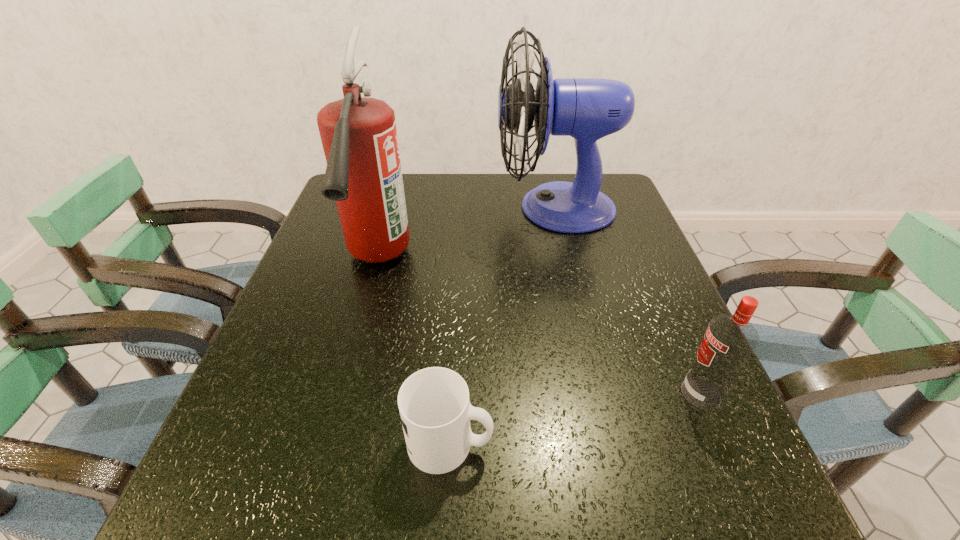
Locate an element on the screen. The height and width of the screenshot is (540, 960). vacant space located 0.240m on the front label of the second shortest object is located at coordinates (543, 393).

Identify the location of free space located on the front label of the second shortest object. The width and height of the screenshot is (960, 540). tap(549, 393).

This screenshot has width=960, height=540. Find the location of `vacant region located on the front label of the second shortest object`. vacant region located on the front label of the second shortest object is located at coordinates (468, 393).

What are the coordinates of `vacant space located on the handle side of the shortest object` in the screenshot? It's located at 593,443.

The image size is (960, 540). I want to click on object at the far edge, so click(x=587, y=109).

Locate an element on the screen. The width and height of the screenshot is (960, 540). object positioned at the near edge is located at coordinates (435, 410).

Find the location of a particular element. object present at the left edge is located at coordinates (363, 175).

The image size is (960, 540). Find the location of `fan at the right edge`. fan at the right edge is located at coordinates 587,109.

The width and height of the screenshot is (960, 540). In order to click on vodka that is positioned at the right edge in this screenshot , I will do tap(729, 341).

Find the location of `object at the far right corner`. object at the far right corner is located at coordinates (587, 109).